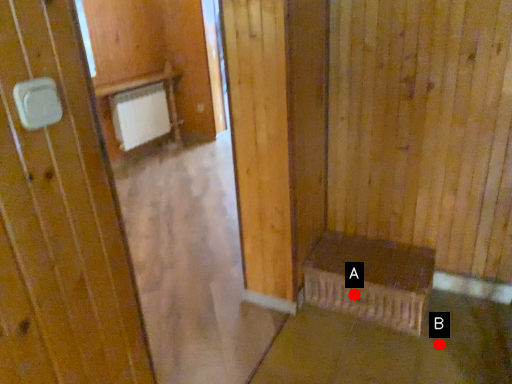
Question: Two points are circled on the image, labeled by A and B beside each circle. Which point appears farthest from the camera in this image?

Choices:
 (A) A is further
 (B) B is further

Answer: (A)